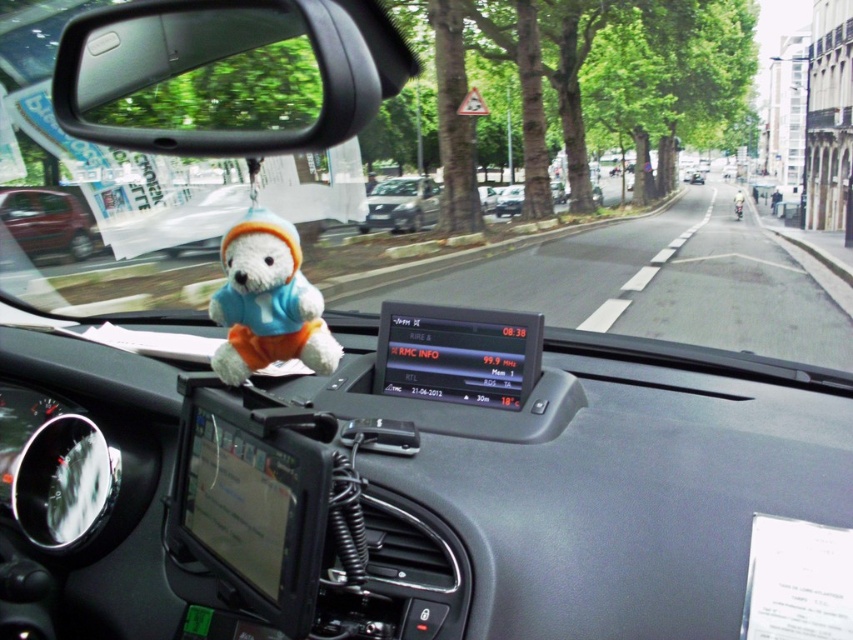
Question: Which object is the farthest from the metallic silver car at center?

Choices:
 (A) transparent plastic view mirror at upper left
 (B) metallic red car at left
 (C) white plush bear at center

Answer: (C)

Question: Observing the image, what is the correct spatial positioning of white plush bear at center in reference to metallic red car at left?

Choices:
 (A) right
 (B) left

Answer: (A)

Question: Is white plush bear at center thinner than metallic red car at left?

Choices:
 (A) no
 (B) yes

Answer: (B)

Question: Can you confirm if white plush bear at center is positioned below satin silver car at center?

Choices:
 (A) no
 (B) yes

Answer: (B)

Question: Which of the following is the closest to the observer?

Choices:
 (A) metallic red car at left
 (B) metallic silver car at center

Answer: (A)

Question: Which object is closer to the camera taking this photo?

Choices:
 (A) white plush bear at center
 (B) transparent plastic view mirror at upper left

Answer: (B)